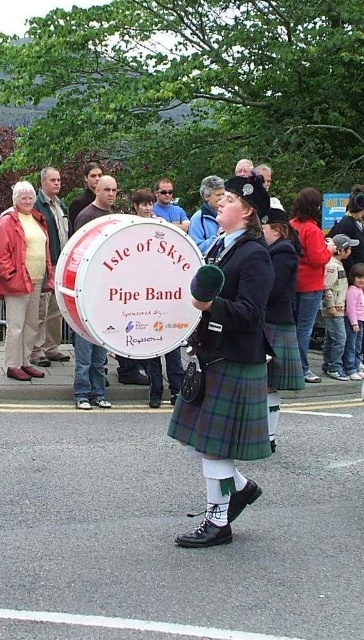
You are a photographer standing at the event. You want to take a closeup photo of the plaid fabric kilt at center. The camera you have can focus on objects within 4 meters. Will you be able to capture a clear closeup?

The plaid fabric kilt at center is 4.23 meters away from the camera, which is beyond the 4 meter focus range. Therefore, the photographer cannot capture a clear closeup with the current camera settings.

You are a photographer at the parade and want to capture the plaid fabric kilt at center. You notice a point at coordinates (228, 362). Is this point likely on the plaid fabric kilt at center?

Yes, the point at coordinates (228, 362) marks the plaid fabric kilt at center, so it is likely on the kilt.